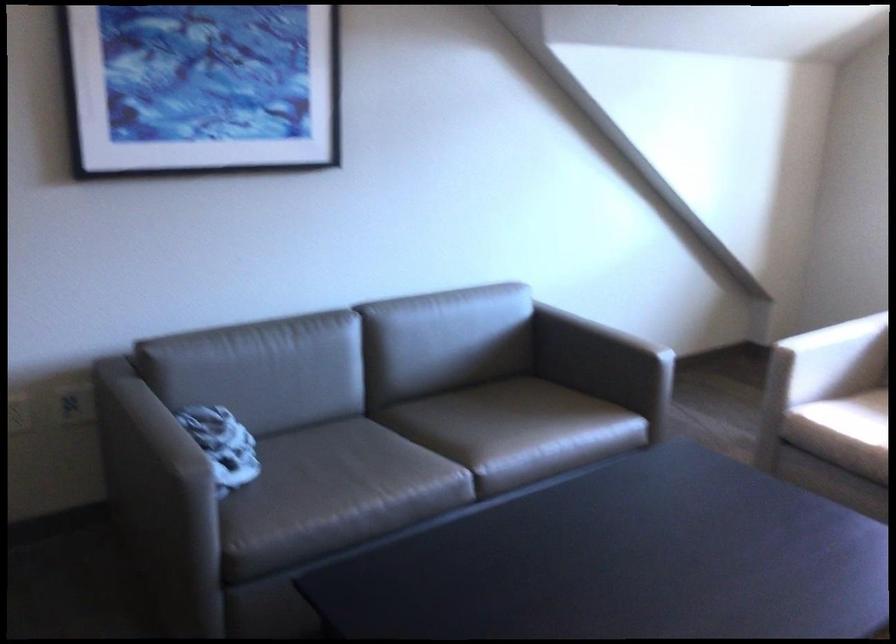
This screenshot has width=896, height=644. What do you see at coordinates (848, 418) in the screenshot? I see `the chair sitting surface` at bounding box center [848, 418].